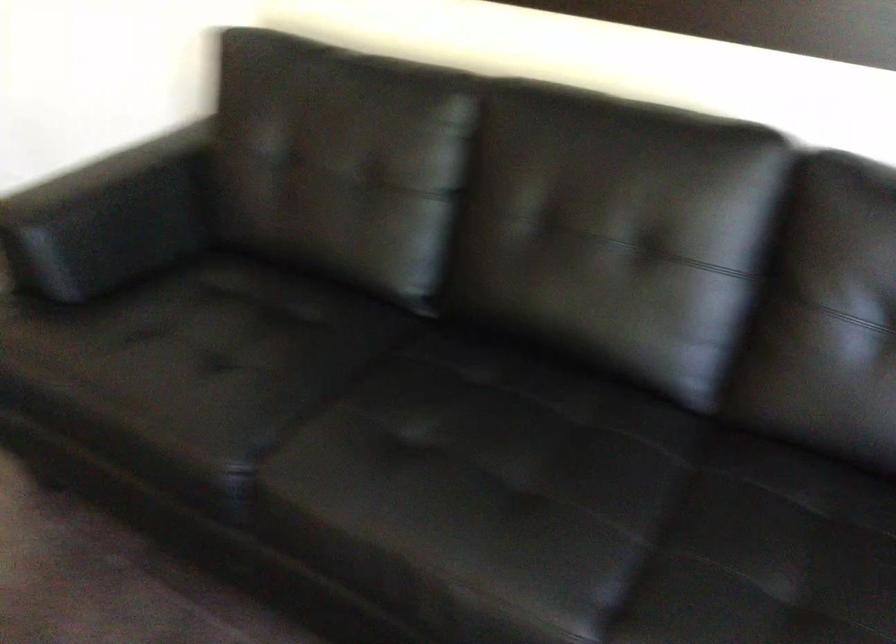
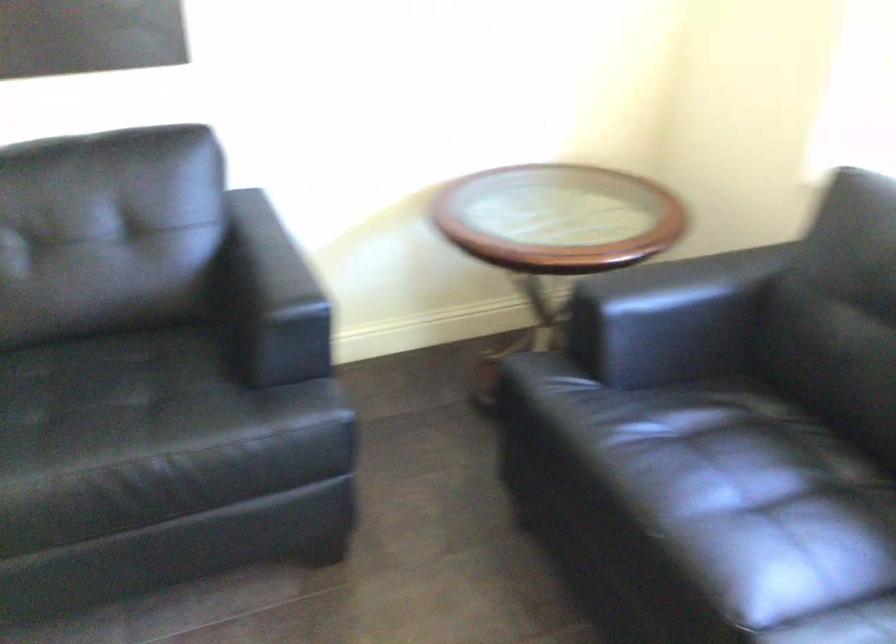
Question: The camera is either moving clockwise (left) or counter-clockwise (right) around the object. The first image is from the beginning of the video and the second image is from the end. Is the camera moving left or right when shooting the video?

Choices:
 (A) Left
 (B) Right

Answer: (A)